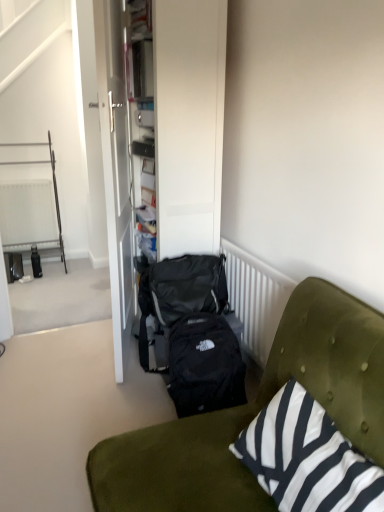
The image size is (384, 512). Identify the location of free location in front of white glossy door at center. (85, 396).